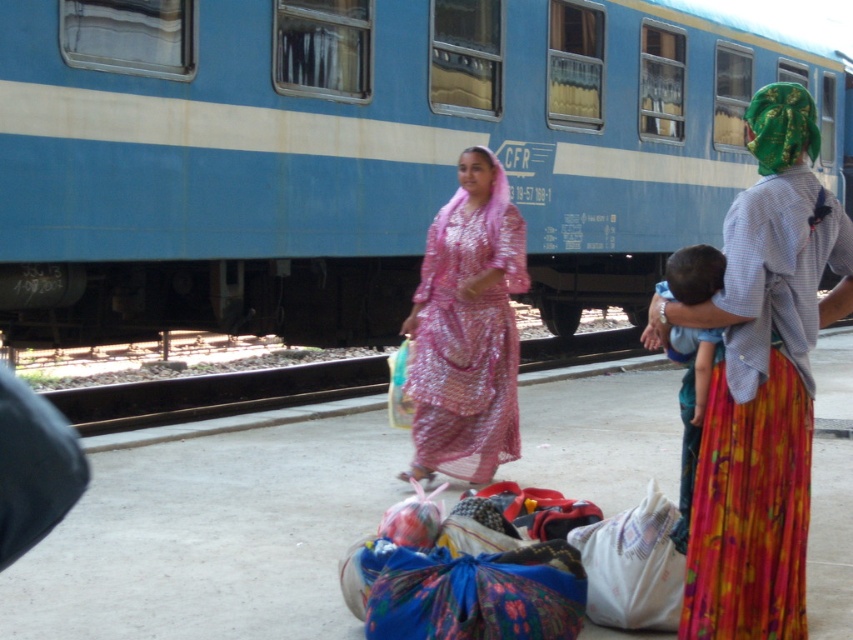
Question: Can you confirm if blue painted train at center is positioned above pink sequined dress at center?

Choices:
 (A) yes
 (B) no

Answer: (A)

Question: Does blue painted train at center have a lesser width compared to pink sequined dress at center?

Choices:
 (A) yes
 (B) no

Answer: (B)

Question: Which point is farther to the camera?

Choices:
 (A) blue painted train at center
 (B) pink sequined dress at center

Answer: (A)

Question: Is blue painted train at center above pink sequined dress at center?

Choices:
 (A) yes
 (B) no

Answer: (A)

Question: Which of the following is the farthest from the observer?

Choices:
 (A) pink sequined dress at center
 (B) blue painted train at center

Answer: (B)